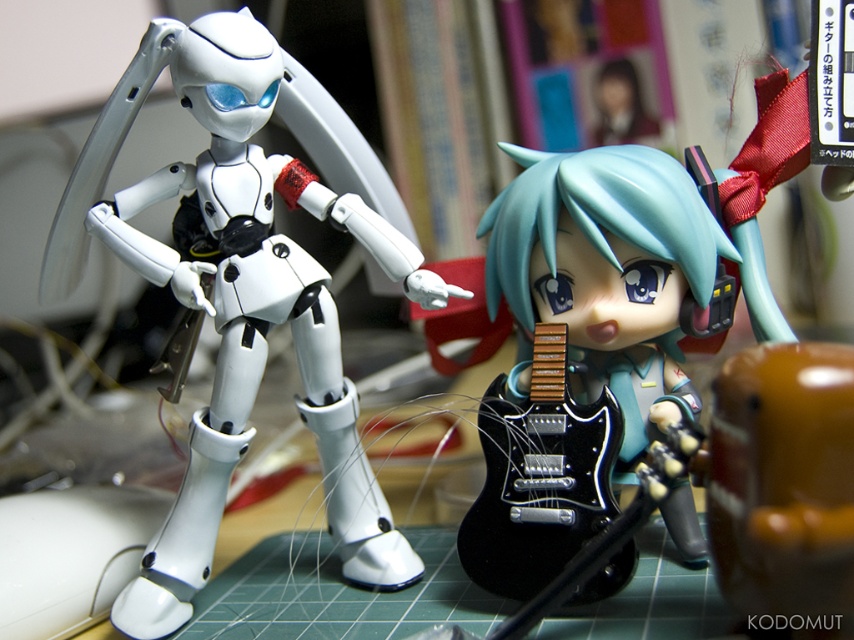
In the scene shown: You are a robot inspector checking the positioning of the white matte robot at left and the chibi character with headphones at right on a green cutting mat. The mat has grid lines for precision. A specific point at coordinates (244,285) is marked. Which object is this point located on?

The point at coordinates (244,285) is on the white matte robot at left according to the provided description.

You are a collector who wants to display both the white matte robot at left and the black glossy electric guitar at center on a shelf. The shelf has a total length of 30 centimeters. Can both items fit side by side without overlapping?

The white matte robot at left is 25.65 centimeters from the black glossy electric guitar at center. Since the distance between them is less than the shelf length of 30 centimeters, both items can fit side by side without overlapping.